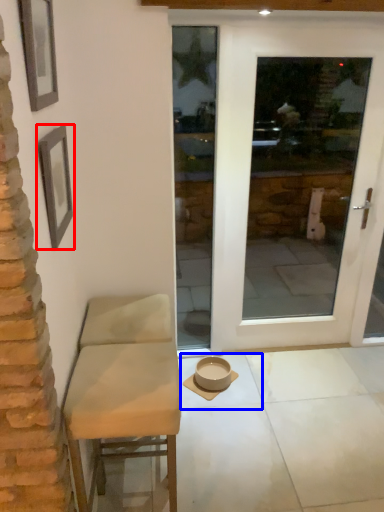
Question: Which of the following is the farthest to the observer, picture frame (highlighted by a red box) or tile (highlighted by a blue box)?

Choices:
 (A) picture frame
 (B) tile

Answer: (B)